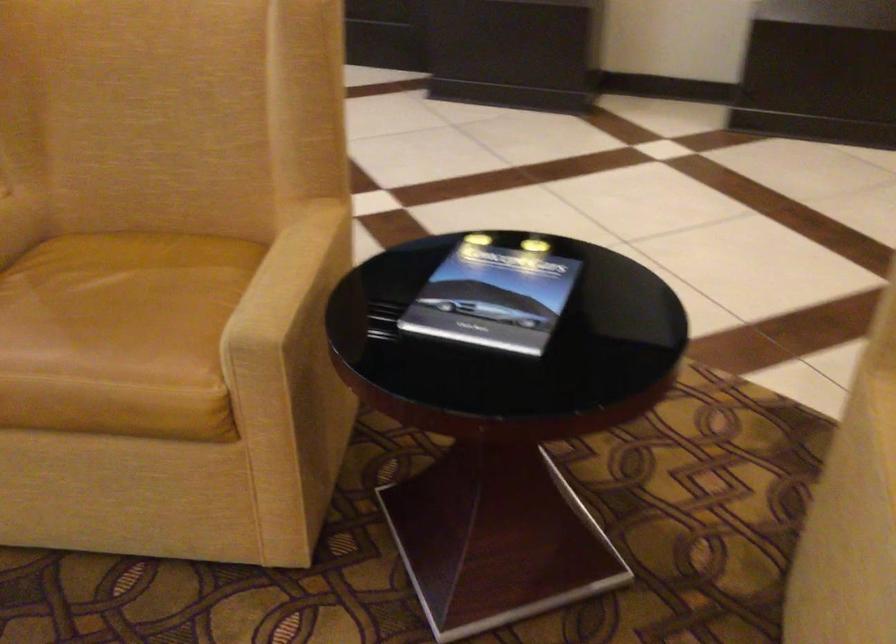
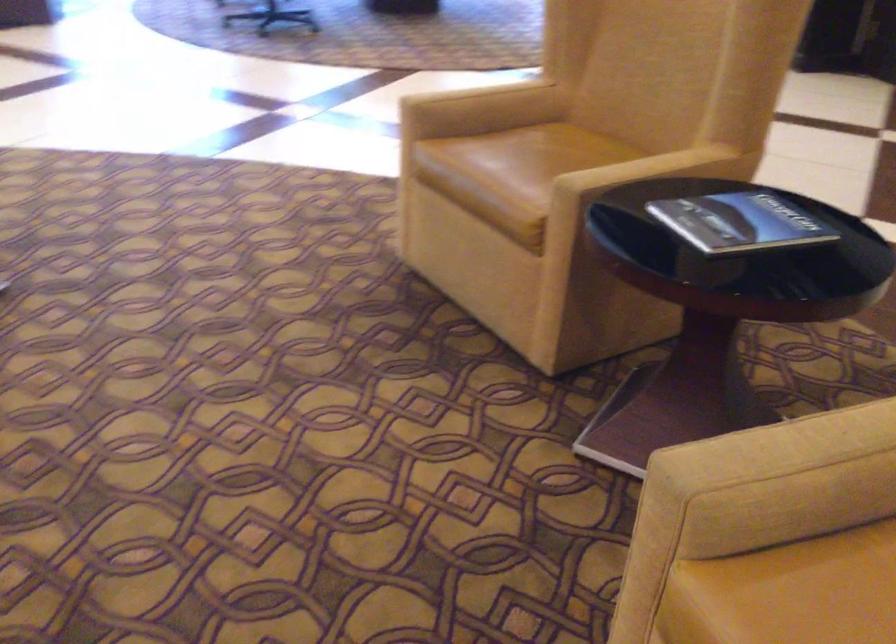
Question: The camera is either moving clockwise (left) or counter-clockwise (right) around the object. The first image is from the beginning of the video and the second image is from the end. Is the camera moving left or right when shooting the video?

Choices:
 (A) Left
 (B) Right

Answer: (B)